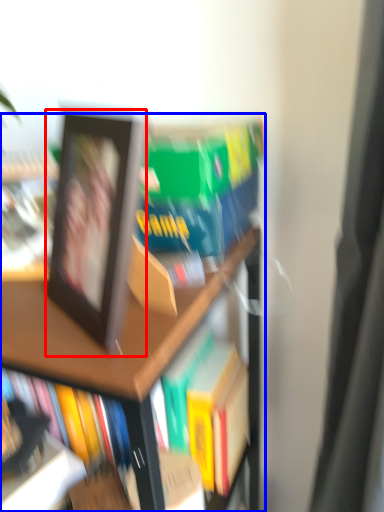
Question: Among these objects, which one is nearest to the camera, picture frame (highlighted by a red box) or bookcase (highlighted by a blue box)?

Choices:
 (A) picture frame
 (B) bookcase

Answer: (A)